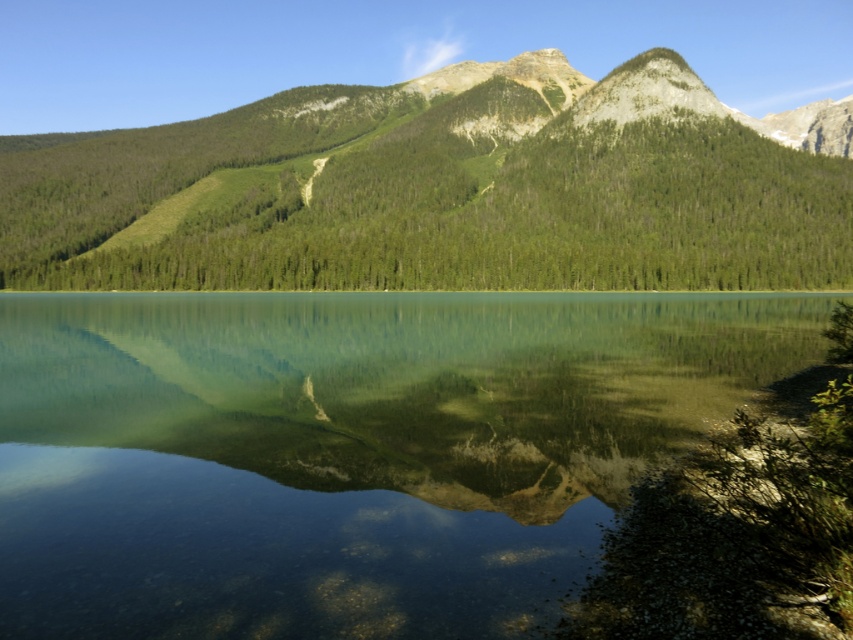
Question: Is green glassy water at center positioned before green textured mountain range at upper center?

Choices:
 (A) no
 (B) yes

Answer: (B)

Question: Among these points, which one is nearest to the camera?

Choices:
 (A) (244, 180)
 (B) (663, 317)

Answer: (B)

Question: Among these points, which one is farthest from the camera?

Choices:
 (A) (294, 454)
 (B) (624, 152)

Answer: (B)

Question: Can you confirm if green glassy water at center is positioned below green textured mountain range at upper center?

Choices:
 (A) no
 (B) yes

Answer: (B)

Question: Is green glassy water at center below green textured mountain range at upper center?

Choices:
 (A) no
 (B) yes

Answer: (B)